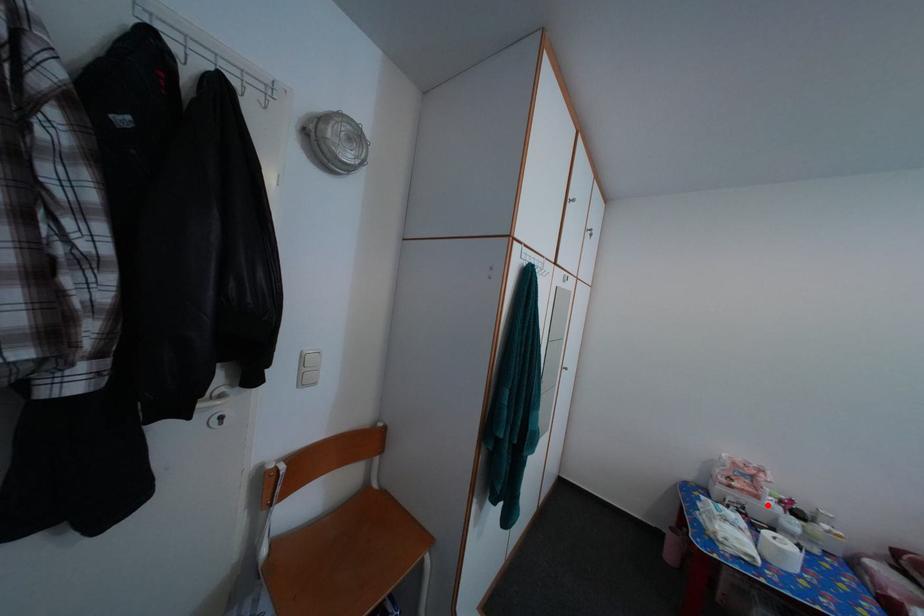
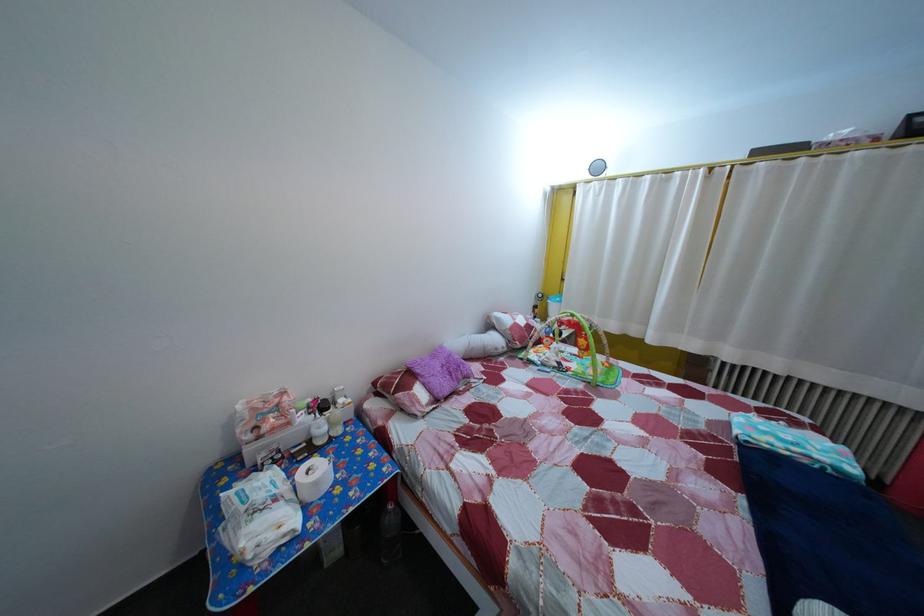
The point at the highlighted location is marked in the first image. Where is the corresponding point in the second image?

(298, 432)